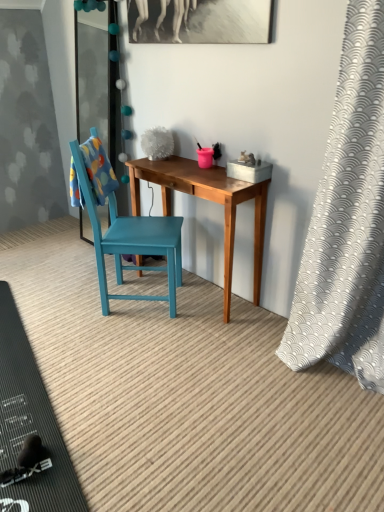
Question: Would you say wooden desk at center contains teal wooden chair at center?

Choices:
 (A) no
 (B) yes

Answer: (A)

Question: Is wooden desk at center shorter than teal wooden chair at center?

Choices:
 (A) yes
 (B) no

Answer: (A)

Question: Considering the relative positions of wooden desk at center and teal wooden chair at center in the image provided, is wooden desk at center to the right of teal wooden chair at center from the viewer's perspective?

Choices:
 (A) no
 (B) yes

Answer: (B)

Question: Are wooden desk at center and teal wooden chair at center far apart?

Choices:
 (A) yes
 (B) no

Answer: (B)

Question: From a real-world perspective, is wooden desk at center over teal wooden chair at center?

Choices:
 (A) no
 (B) yes

Answer: (A)

Question: From a real-world perspective, is wooden desk at center above or below black rubber mat at lower left?

Choices:
 (A) above
 (B) below

Answer: (A)

Question: From the image's perspective, is wooden desk at center located above or below black rubber mat at lower left?

Choices:
 (A) above
 (B) below

Answer: (A)

Question: Which is correct: wooden desk at center is inside black rubber mat at lower left, or outside of it?

Choices:
 (A) outside
 (B) inside

Answer: (A)

Question: Would you say wooden desk at center is to the left or to the right of black rubber mat at lower left in the picture?

Choices:
 (A) left
 (B) right

Answer: (B)

Question: In the image, is black rubber mat at lower left positioned in front of or behind wooden desk at center?

Choices:
 (A) front
 (B) behind

Answer: (A)

Question: Is point (56, 501) closer or farther from the camera than point (225, 241)?

Choices:
 (A) closer
 (B) farther

Answer: (A)

Question: From the image's perspective, is black rubber mat at lower left located above or below wooden desk at center?

Choices:
 (A) below
 (B) above

Answer: (A)

Question: Considering the positions of black rubber mat at lower left and wooden desk at center in the image, is black rubber mat at lower left taller or shorter than wooden desk at center?

Choices:
 (A) tall
 (B) short

Answer: (B)

Question: Would you say white textured curtain at right is inside or outside black rubber mat at lower left?

Choices:
 (A) outside
 (B) inside

Answer: (A)

Question: Is point (324, 300) closer or farther from the camera than point (64, 449)?

Choices:
 (A) farther
 (B) closer

Answer: (A)